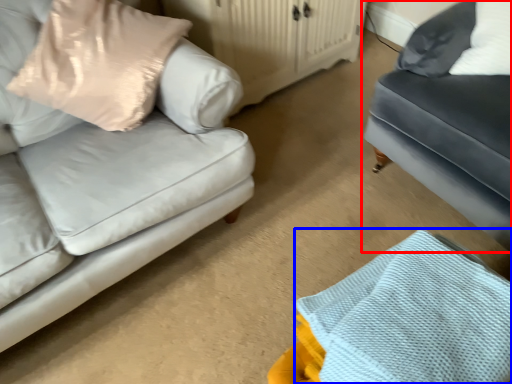
Question: Among these objects, which one is nearest to the camera, studio couch (highlighted by a red box) or material (highlighted by a blue box)?

Choices:
 (A) studio couch
 (B) material

Answer: (B)